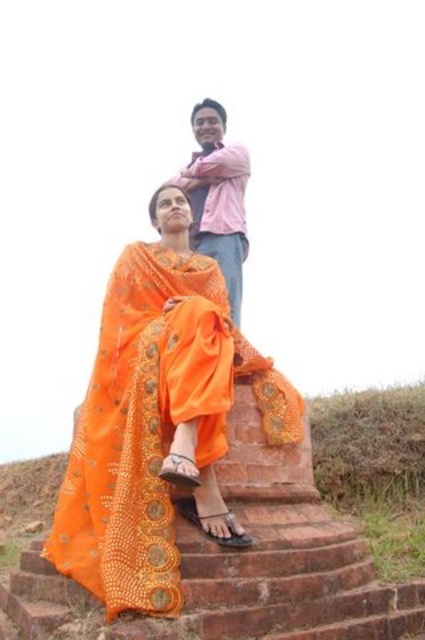
You are a photographer trying to capture a candid shot of the pink cotton shirt at upper center without including the orange sheer fabric at center in the frame. Based on their positions, can you position yourself in a way to achieve this?

The orange sheer fabric at center is taller than the pink cotton shirt at upper center. Since the fabric is taller, positioning yourself lower or angling the camera downward might help exclude the fabric while focusing on the pink cotton shirt at upper center.

You are a photographer wanting to capture both the orange sheer fabric at center and the pink cotton shirt at upper center in the same frame. Based on their positions, which object should you focus on first to ensure both are in focus?

The orange sheer fabric at center is in front of the pink cotton shirt at upper center, so you should focus on the orange sheer fabric at center first to ensure both are in focus.

You are a photographer planning to take a portrait of the two people in the scene. You want to ensure that both the orange sheer fabric at center and the pink cotton shirt at upper center are visible in the frame. Based on their positions, which object is closer to the left edge of the photo?

The pink cotton shirt at upper center is closer to the left edge of the photo because the orange sheer fabric at center is positioned on the right side of it.